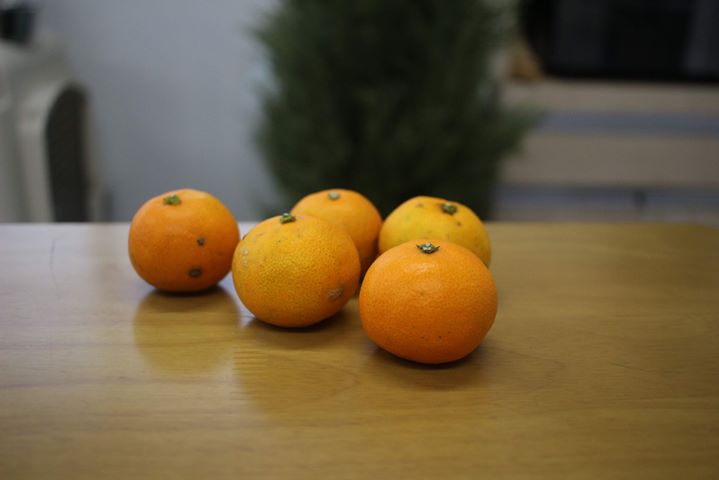
At what (x,y) coordinates should I click in order to perform the action: click on blurry feather duster shape. Please return your answer as a coordinate pair (x, y). Looking at the image, I should click on (412, 88).